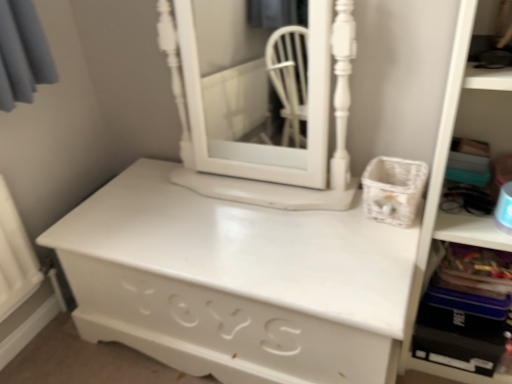
This screenshot has height=384, width=512. Identify the location of white painted wood medicine cabinet at center. (261, 110).

Which is more to the left, white matte chest of drawers at center or white painted wood medicine cabinet at center?

Positioned to the left is white matte chest of drawers at center.

Is white matte chest of drawers at center aimed at white painted wood medicine cabinet at center?

No, white matte chest of drawers at center is not facing towards white painted wood medicine cabinet at center.

How many degrees apart are the facing directions of white matte chest of drawers at center and white painted wood medicine cabinet at center?

The angle between the facing direction of white matte chest of drawers at center and the facing direction of white painted wood medicine cabinet at center is 0.326 degrees.

From a real-world perspective, does white matte chest of drawers at center sit lower than white painted wood medicine cabinet at center?

Yes, from a real-world perspective, white matte chest of drawers at center is below white painted wood medicine cabinet at center.

Would you say white plastic bookshelf at right is part of white matte chest of drawers at center's contents?

That's incorrect, white plastic bookshelf at right is not inside white matte chest of drawers at center.

Considering the sizes of white matte chest of drawers at center and white plastic bookshelf at right in the image, is white matte chest of drawers at center wider or thinner than white plastic bookshelf at right?

In the image, white matte chest of drawers at center appears to be wider than white plastic bookshelf at right.

From a real-world perspective, is white matte chest of drawers at center below white plastic bookshelf at right?

Indeed, from a real-world perspective, white matte chest of drawers at center is positioned beneath white plastic bookshelf at right.

Considering the sizes of objects white matte chest of drawers at center and white plastic bookshelf at right in the image provided, who is shorter, white matte chest of drawers at center or white plastic bookshelf at right?

With less height is white matte chest of drawers at center.

From the image's perspective, between white plastic bookshelf at right and white painted wood medicine cabinet at center, who is located below?

white plastic bookshelf at right, from the image's perspective.

Is white plastic bookshelf at right positioned with its back to white painted wood medicine cabinet at center?

No, white plastic bookshelf at right's orientation is not away from white painted wood medicine cabinet at center.

Which of these two, white plastic bookshelf at right or white painted wood medicine cabinet at center, is smaller?

white painted wood medicine cabinet at center.

From a real-world perspective, which object stands above the other?

white plastic bookshelf at right, from a real-world perspective.

Based on the photo, considering the positions of objects white plastic bookshelf at right and white matte chest of drawers at center in the image provided, who is more to the right, white plastic bookshelf at right or white matte chest of drawers at center?

white plastic bookshelf at right.

Is white plastic bookshelf at right not near white matte chest of drawers at center?

They are positioned close to each other.

Is white plastic bookshelf at right not within white matte chest of drawers at center?

Yes, white plastic bookshelf at right is outside of white matte chest of drawers at center.

Is point (325, 40) in front of point (174, 264)?

No.

Between white painted wood medicine cabinet at center and white matte chest of drawers at center, which one has smaller size?

white painted wood medicine cabinet at center is smaller.

Is white painted wood medicine cabinet at center situated inside white matte chest of drawers at center or outside?

white painted wood medicine cabinet at center is spatially situated outside white matte chest of drawers at center.

Can you confirm if white painted wood medicine cabinet at center is positioned to the left of white plastic bookshelf at right?

Correct, you'll find white painted wood medicine cabinet at center to the left of white plastic bookshelf at right.

Who is smaller, white painted wood medicine cabinet at center or white plastic bookshelf at right?

With smaller size is white painted wood medicine cabinet at center.

Is white painted wood medicine cabinet at center positioned behind white plastic bookshelf at right?

Yes, the depth of white painted wood medicine cabinet at center is greater than that of white plastic bookshelf at right.

At what (x,y) coordinates should I click in order to perform the action: click on chest of drawers on the left of white painted wood medicine cabinet at center. Please return your answer as a coordinate pair (x, y). Looking at the image, I should click on (236, 282).

Find the location of a particular element. This screenshot has width=512, height=384. bookshelf above the white matte chest of drawers at center (from the image's perspective) is located at coordinates (441, 191).

Based on their spatial positions, is white plastic bookshelf at right or white matte chest of drawers at center further from white painted wood medicine cabinet at center?

The object further to white painted wood medicine cabinet at center is white plastic bookshelf at right.

From the image, which object appears to be nearer to white plastic bookshelf at right, white matte chest of drawers at center or white painted wood medicine cabinet at center?

Based on the image, white matte chest of drawers at center appears to be nearer to white plastic bookshelf at right.

Looking at the image, which one is located closer to white matte chest of drawers at center, white painted wood medicine cabinet at center or white plastic bookshelf at right?

white plastic bookshelf at right is positioned closer to the anchor white matte chest of drawers at center.

When comparing their distances from white plastic bookshelf at right, does white painted wood medicine cabinet at center or white matte chest of drawers at center seem further?

white painted wood medicine cabinet at center lies further to white plastic bookshelf at right than the other object.

Considering their positions, is white matte chest of drawers at center positioned closer to white painted wood medicine cabinet at center than white plastic bookshelf at right?

white matte chest of drawers at center is closer to white painted wood medicine cabinet at center.

Considering their positions, is white plastic bookshelf at right positioned closer to white matte chest of drawers at center than white painted wood medicine cabinet at center?

white plastic bookshelf at right lies closer to white matte chest of drawers at center than the other object.

Find the location of a particular element. medicine cabinet between white matte chest of drawers at center and white plastic bookshelf at right from left to right is located at coordinates (261, 110).